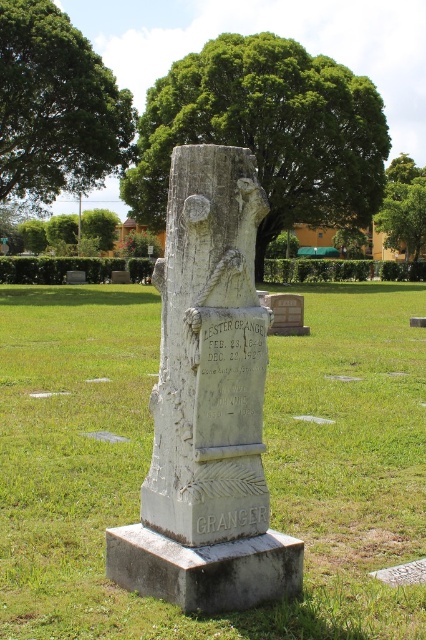
Question: Estimate the real-world distances between objects in this image. Which object is farther from the green leafy tree at upper right?

Choices:
 (A) green leafy tree at center
 (B) green leafy tree at upper center
 (C) green grass at center
 (D) gray stone inscription at center

Answer: (D)

Question: Which point is closer to the camera taking this photo?

Choices:
 (A) (89, 234)
 (B) (198, 259)
 (C) (215, 524)

Answer: (B)

Question: Can you confirm if green leafy tree at center is thinner than green leafy tree at upper right?

Choices:
 (A) no
 (B) yes

Answer: (A)

Question: Does green grass at center come in front of white stone monument at center?

Choices:
 (A) yes
 (B) no

Answer: (A)

Question: Is green leafy tree at center closer to the viewer compared to green leafy tree at upper right?

Choices:
 (A) no
 (B) yes

Answer: (B)

Question: Which object appears farthest from the camera in this image?

Choices:
 (A) green leafy tree at upper left
 (B) white stone monument at center
 (C) green leafy tree at center
 (D) green leafy tree at upper right

Answer: (D)